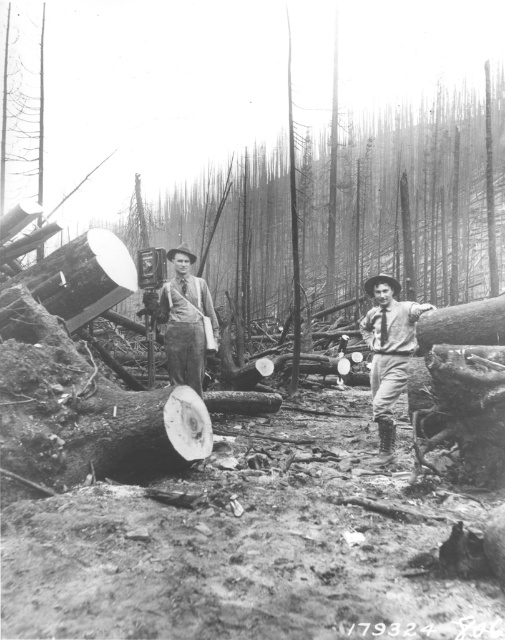
Question: Which point is closer to the camera taking this photo?

Choices:
 (A) (190, 262)
 (B) (389, 349)

Answer: (B)

Question: Can you confirm if rugged denim pants at center is smaller than smooth gray shirt at center?

Choices:
 (A) no
 (B) yes

Answer: (B)

Question: Does rugged denim pants at center appear on the right side of smooth gray shirt at center?

Choices:
 (A) yes
 (B) no

Answer: (A)

Question: Is rugged denim pants at center thinner than smooth gray shirt at center?

Choices:
 (A) yes
 (B) no

Answer: (A)